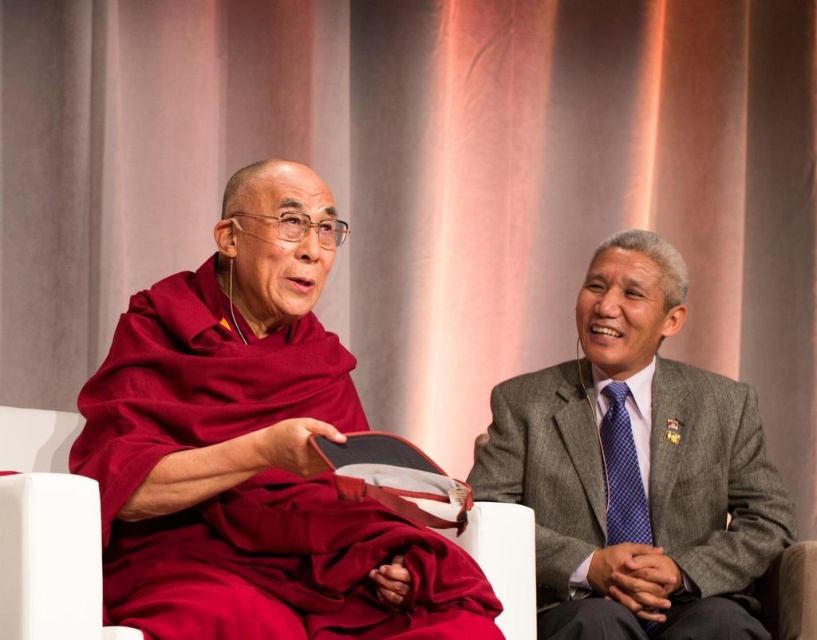
Is the position of silky maroon robe at left less distant than that of gray wool suit at right?

That is True.

In order to click on silky maroon robe at left in this screenshot , I will do 253,451.

The height and width of the screenshot is (640, 817). I want to click on silky maroon robe at left, so click(x=253, y=451).